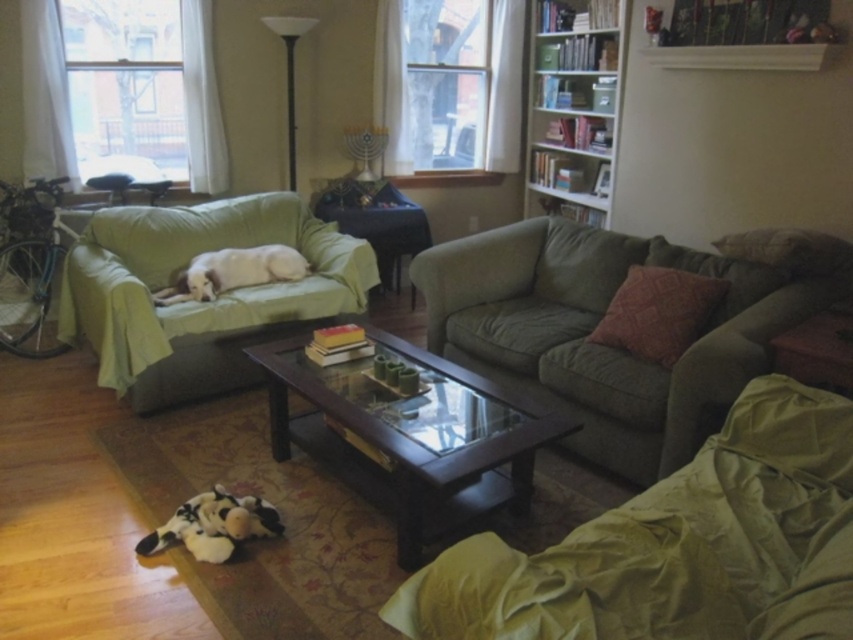
Is green fabric couch at center smaller than white wooden bookshelf at upper right?

Incorrect, green fabric couch at center is not smaller in size than white wooden bookshelf at upper right.

Can you confirm if green fabric couch at center is positioned to the left of white wooden bookshelf at upper right?

Yes, green fabric couch at center is to the left of white wooden bookshelf at upper right.

Does point (697, 365) come behind point (618, 49)?

No, it is not.

At what (x,y) coordinates should I click in order to perform the action: click on green fabric couch at center. Please return your answer as a coordinate pair (x, y). Image resolution: width=853 pixels, height=640 pixels. Looking at the image, I should click on (596, 323).

Which is below, white wooden bookshelf at upper right or white soft dog at center?

Positioned lower is white soft dog at center.

Is point (576, 35) less distant than point (183, 300)?

No.

The image size is (853, 640). I want to click on white wooden bookshelf at upper right, so click(x=575, y=106).

Can you confirm if green fabric couch at center is positioned below transparent glass window at upper left?

Correct, green fabric couch at center is located below transparent glass window at upper left.

Which is behind, point (761, 328) or point (190, 138)?

Positioned behind is point (190, 138).

Describe the element at coordinates (596, 323) in the screenshot. This screenshot has width=853, height=640. I see `green fabric couch at center` at that location.

You are a GUI agent. You are given a task and a screenshot of the screen. Output one action in this format:
    pyautogui.click(x=<x>, y=<y>)
    Task: Click on the green fabric couch at center
    
    Given the screenshot: What is the action you would take?
    pyautogui.click(x=596, y=323)